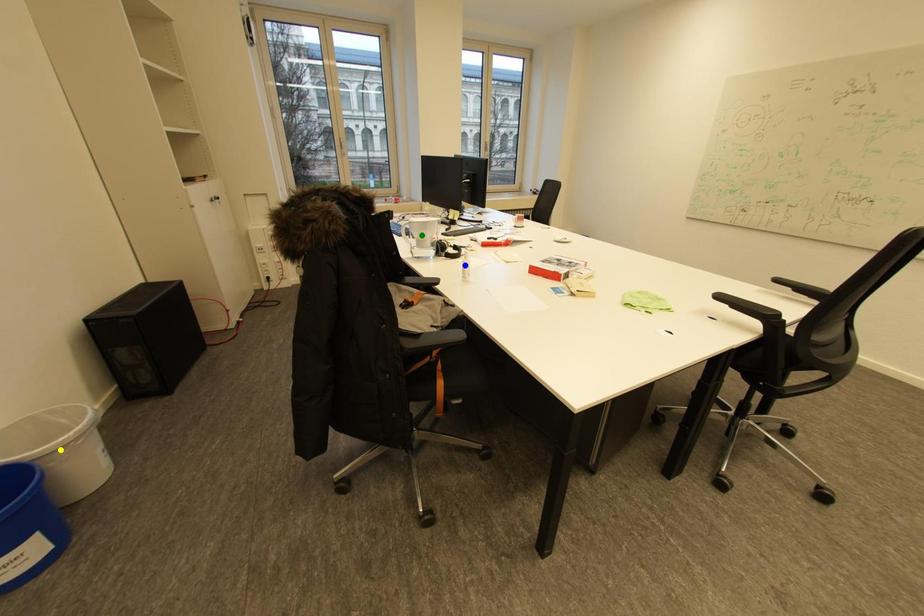
Order these from nearest to farthest:
1. blue point
2. green point
3. yellow point

yellow point < blue point < green point